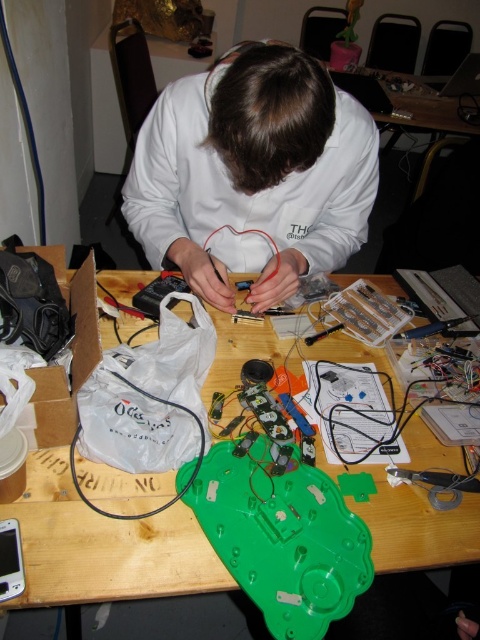
Is white matte shirt at center thinner than green plastic table at center?

Correct, white matte shirt at center's width is less than green plastic table at center's.

Where is `white matte shirt at center`? white matte shirt at center is located at coordinates (252, 173).

This screenshot has height=640, width=480. What are the coordinates of `white matte shirt at center` in the screenshot? It's located at (252, 173).